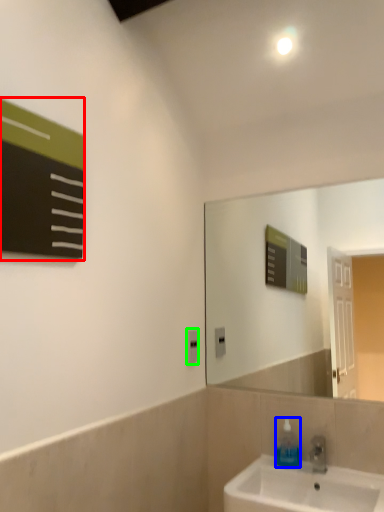
Question: Based on their relative distances, which object is nearer to bulletin board (highlighted by a red box)? Choose from soap dispenser (highlighted by a blue box) and electric outlet (highlighted by a green box).

Choices:
 (A) soap dispenser
 (B) electric outlet

Answer: (B)